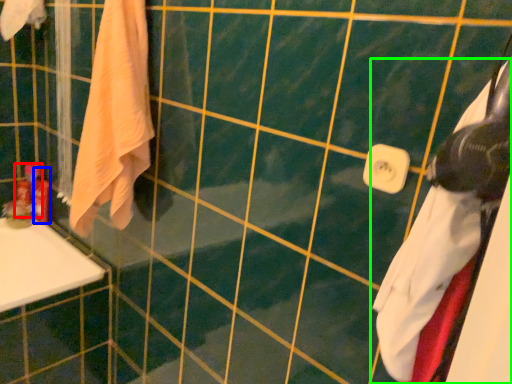
Question: Estimate the real-world distances between objects in this image. Which object is farther from toiletry (highlighted by a red box), toiletry (highlighted by a blue box) or towel (highlighted by a green box)?

Choices:
 (A) toiletry
 (B) towel

Answer: (B)